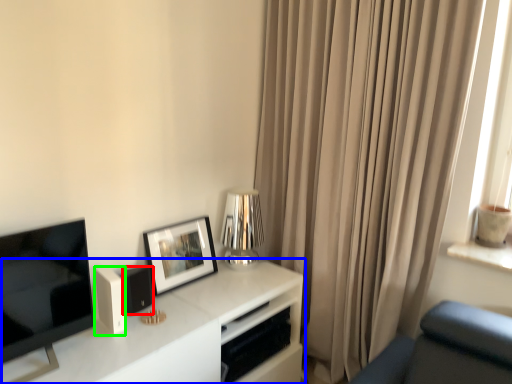
Question: Estimate the real-world distances between objects in this image. Which object is farther from speaker (highlighted by a red box), table (highlighted by a blue box) or appliance (highlighted by a green box)?

Choices:
 (A) table
 (B) appliance

Answer: (A)